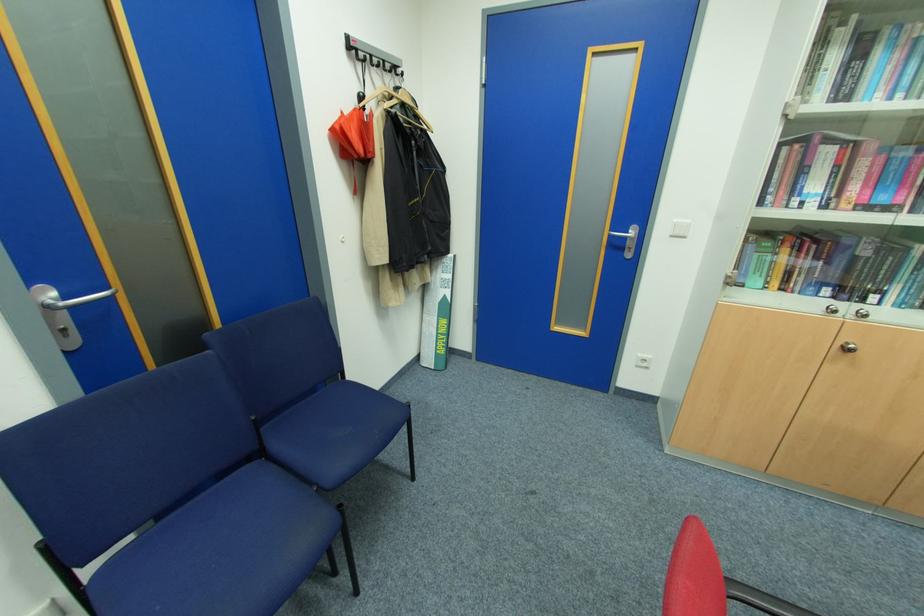
The image size is (924, 616). In order to click on rolled-up banner in this screenshot , I will do `click(436, 314)`.